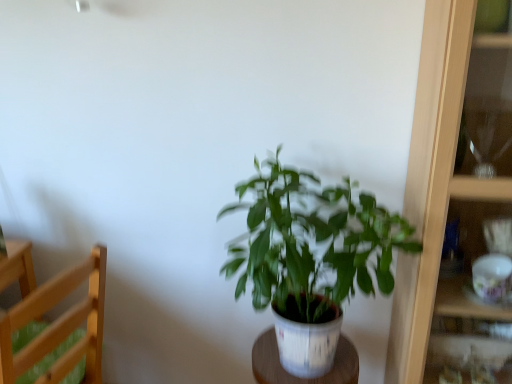
Where is `wooden cabinet at right`? wooden cabinet at right is located at coordinates (429, 179).

From a real-world perspective, who is located higher, wooden cabinet at right or white wood table at center?

From a 3D spatial view, wooden cabinet at right is above.

Considering the sizes of objects wooden cabinet at right and white wood table at center in the image provided, who is thinner, wooden cabinet at right or white wood table at center?

white wood table at center is thinner.

Locate an element on the screen. Image resolution: width=512 pixels, height=384 pixels. cabinet lying in front of the white wood table at center is located at coordinates (429, 179).

Does point (415, 148) come closer to viewer compared to point (266, 347)?

Yes, point (415, 148) is in front of point (266, 347).

Is wooden cabinet at right inside white wood table at center?

No.

Is wooden cabinet at right at the back of white wood table at center?

white wood table at center does not have its back to wooden cabinet at right.

Considering the sizes of objects white wood table at center and wooden cabinet at right in the image provided, who is taller, white wood table at center or wooden cabinet at right?

With more height is wooden cabinet at right.

How different are the orientations of white wood table at center and wooden cabinet at right in degrees?

1.1 degrees.

Between green matte plant at center and wooden cabinet at right, which one appears on the right side from the viewer's perspective?

Positioned to the right is wooden cabinet at right.

Does point (268, 177) lie in front of point (408, 284)?

Yes.

How many degrees apart are the facing directions of green matte plant at center and wooden cabinet at right?

The angle between the facing direction of green matte plant at center and the facing direction of wooden cabinet at right is 3.24 degrees.

I want to click on houseplant below the wooden cabinet at right (from the image's perspective), so click(312, 244).

Does green matte plant at center have a lesser height compared to white wood table at center?

No.

Locate an element on the screen. houseplant that appears on the right of white wood table at center is located at coordinates (312, 244).

Consider the image. From a real-world perspective, which object stands above the other?

In real-world perspective, green matte plant at center is above.

Looking at this image, are green matte plant at center and white wood table at center beside each other?

green matte plant at center and white wood table at center are clearly separated.

From a real-world perspective, is white wood table at center beneath green matte plant at center?

Yes.

Does white wood table at center contain green matte plant at center?

Definitely not — green matte plant at center is not inside white wood table at center.

From the image's perspective, which is below, white wood table at center or green matte plant at center?

white wood table at center.

Which is more to the left, white wood table at center or green matte plant at center?

white wood table at center is more to the left.

Considering the sizes of green matte plant at center and light wood chair at left in the image, is green matte plant at center bigger or smaller than light wood chair at left?

Clearly, green matte plant at center is larger in size than light wood chair at left.

Which of these two, green matte plant at center or light wood chair at left, is thinner?

Thinner between the two is green matte plant at center.

Is green matte plant at center directly adjacent to light wood chair at left?

There is a gap between green matte plant at center and light wood chair at left.

Would you say green matte plant at center is outside light wood chair at left?

Absolutely, green matte plant at center is external to light wood chair at left.

Is light wood chair at left at the back of wooden cabinet at right?

No, light wood chair at left is not at the back of wooden cabinet at right.

Considering the relative sizes of wooden cabinet at right and light wood chair at left in the image provided, is wooden cabinet at right thinner than light wood chair at left?

Correct, the width of wooden cabinet at right is less than that of light wood chair at left.

In the image, is wooden cabinet at right positioned in front of or behind light wood chair at left?

Clearly, wooden cabinet at right is in front of light wood chair at left.

Find the location of a particular element. The image size is (512, 384). cabinet in front of the white wood table at center is located at coordinates (429, 179).

Image resolution: width=512 pixels, height=384 pixels. Identify the location of cabinet lying above the white wood table at center (from the image's perspective). coord(429,179).

Looking at the image, which one is located closer to light wood chair at left, green matte plant at center or white wood table at center?

green matte plant at center is closer to light wood chair at left.

Consider the image. From the image, which object appears to be farther from white wood table at center, green matte plant at center or wooden cabinet at right?

The object further to white wood table at center is wooden cabinet at right.

Based on their spatial positions, is green matte plant at center or white wood table at center closer to wooden cabinet at right?

Based on the image, green matte plant at center appears to be nearer to wooden cabinet at right.

Considering their positions, is green matte plant at center positioned further to wooden cabinet at right than light wood chair at left?

light wood chair at left is further to wooden cabinet at right.

Considering their positions, is green matte plant at center positioned closer to light wood chair at left than wooden cabinet at right?

Among the two, green matte plant at center is located nearer to light wood chair at left.

Considering their positions, is green matte plant at center positioned closer to white wood table at center than light wood chair at left?

Among the two, green matte plant at center is located nearer to white wood table at center.

Estimate the real-world distances between objects in this image. Which object is closer to light wood chair at left, white wood table at center or green matte plant at center?

green matte plant at center is closer to light wood chair at left.

From the image, which object appears to be nearer to green matte plant at center, light wood chair at left or white wood table at center?

white wood table at center is positioned closer to the anchor green matte plant at center.

Identify the location of houseplant located between white wood table at center and wooden cabinet at right in the left-right direction. This screenshot has height=384, width=512. (312, 244).

Locate an element on the screen. table located between light wood chair at left and green matte plant at center in the left-right direction is located at coordinates (298, 377).

Where is `houseplant between light wood chair at left and wooden cabinet at right from left to right`? Image resolution: width=512 pixels, height=384 pixels. houseplant between light wood chair at left and wooden cabinet at right from left to right is located at coordinates (312, 244).

At what (x,y) coordinates should I click in order to perform the action: click on table between light wood chair at left and wooden cabinet at right from left to right. Please return your answer as a coordinate pair (x, y). The width and height of the screenshot is (512, 384). Looking at the image, I should click on (298, 377).